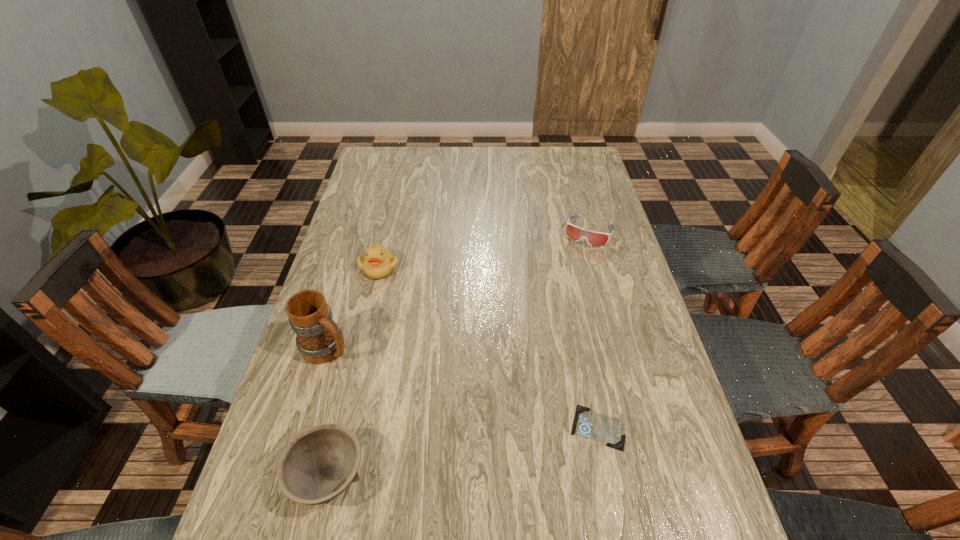
Where is `bowl situated at the left edge`? The height and width of the screenshot is (540, 960). bowl situated at the left edge is located at coordinates (320, 463).

Find the location of a particular element. The height and width of the screenshot is (540, 960). mug located in the left edge section of the desktop is located at coordinates pyautogui.click(x=319, y=339).

Identify the location of duckling that is at the left edge. (378, 263).

The image size is (960, 540). I want to click on identity card located at the right edge, so click(609, 430).

This screenshot has height=540, width=960. I want to click on goggles at the right edge, so click(x=593, y=238).

Where is `object at the near left corner`? The width and height of the screenshot is (960, 540). object at the near left corner is located at coordinates (320, 463).

Identify the location of vacant space at the far edge. (533, 175).

Where is `vacant space at the left edge of the desktop`? This screenshot has height=540, width=960. vacant space at the left edge of the desktop is located at coordinates (373, 226).

At what (x,y) coordinates should I click in order to perform the action: click on free space at the right edge of the desktop. Please return your answer as a coordinate pair (x, y). This screenshot has height=540, width=960. Looking at the image, I should click on (642, 313).

The width and height of the screenshot is (960, 540). Find the location of `blank space at the far right corner of the desktop`. blank space at the far right corner of the desktop is located at coordinates (591, 153).